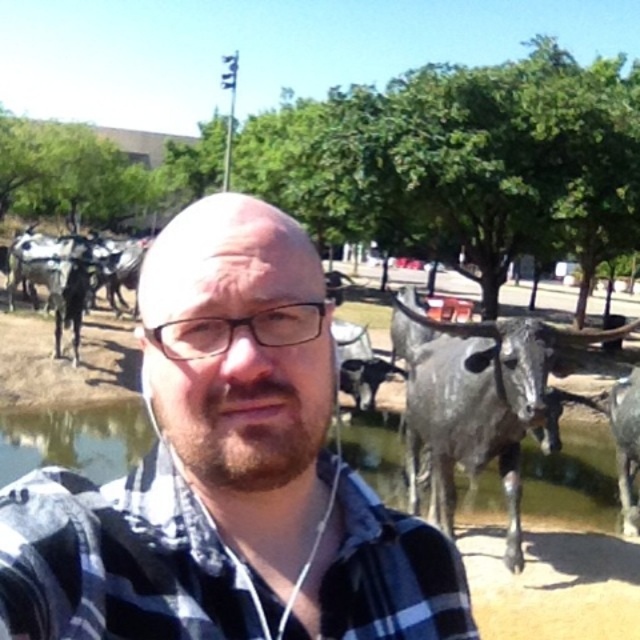
Who is positioned more to the left, clear water at center or gray metallic bull at right?

clear water at center is more to the left.

Does point (365, 433) lie in front of point (444, 412)?

No, (365, 433) is behind (444, 412).

This screenshot has width=640, height=640. I want to click on clear water at center, so click(573, 497).

The width and height of the screenshot is (640, 640). I want to click on clear water at center, so click(573, 497).

Can you confirm if blue plaid shirt at center is shorter than clear water at center?

Correct, blue plaid shirt at center is not as tall as clear water at center.

Is point (394, 584) closer to camera compared to point (561, 512)?

Yes, it is in front of point (561, 512).

At what (x,y) coordinates should I click in order to perform the action: click on blue plaid shirt at center. Please return your answer as a coordinate pair (x, y). Looking at the image, I should click on (227, 474).

Does point (282, 448) lie behind point (506, 541)?

No.

Who is taller, blue plaid shirt at center or gray metallic bull at right?

Standing taller between the two is gray metallic bull at right.

Find the location of `blue plaid shirt at center`. blue plaid shirt at center is located at coordinates (227, 474).

At what (x,y) coordinates should I click in order to perform the action: click on blue plaid shirt at center. Please return your answer as a coordinate pair (x, y). The height and width of the screenshot is (640, 640). Looking at the image, I should click on (227, 474).